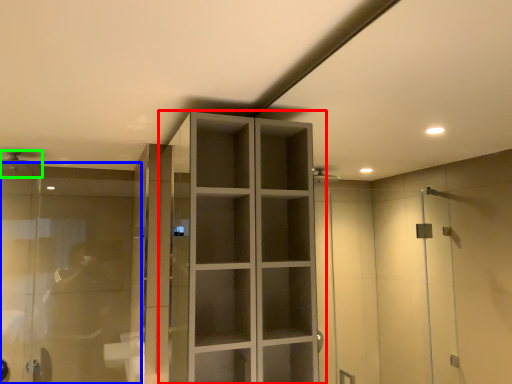
Question: Based on their relative distances, which object is nearer to cupboard (highlighted by a red box)? Choose from glass door (highlighted by a blue box) and shower (highlighted by a green box).

Choices:
 (A) glass door
 (B) shower

Answer: (A)